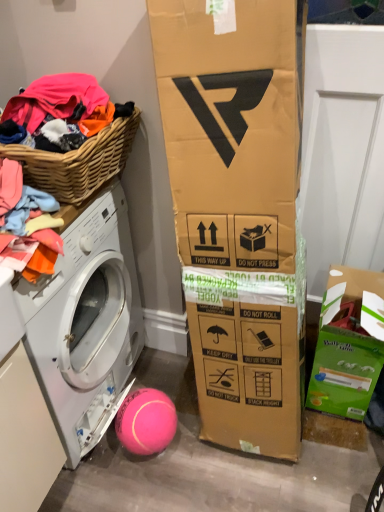
This screenshot has width=384, height=512. Find the location of `green cardboard box at lower right`. green cardboard box at lower right is located at coordinates (345, 347).

Image resolution: width=384 pixels, height=512 pixels. What do you see at coordinates (345, 347) in the screenshot? I see `green cardboard box at lower right` at bounding box center [345, 347].

This screenshot has width=384, height=512. Describe the element at coordinates (78, 162) in the screenshot. I see `woven wood basket at left` at that location.

What is the approximate width of pink rubber ball at lower center?

It is 7.05 inches.

You are a GUI agent. You are given a task and a screenshot of the screen. Output one action in this format:
    pyautogui.click(x=<x>, y=<y>)
    Task: Click on the green cardboard box at lower right
    
    Given the screenshot: What is the action you would take?
    pyautogui.click(x=345, y=347)

Does green cardboard box at lower right have a smaller size compared to pink rubber ball at lower center?

Actually, green cardboard box at lower right might be larger than pink rubber ball at lower center.

Is green cardboard box at lower right touching pink rubber ball at lower center?

No, green cardboard box at lower right is not making contact with pink rubber ball at lower center.

Could you tell me if green cardboard box at lower right is turned towards pink rubber ball at lower center?

No, green cardboard box at lower right is not facing towards pink rubber ball at lower center.

From the image's perspective, which is above, green cardboard box at lower right or pink rubber ball at lower center?

green cardboard box at lower right, from the image's perspective.

From the image's perspective, is white glossy washing machine at left on pink rubber ball at lower center?

Yes, from the image's perspective, white glossy washing machine at left is over pink rubber ball at lower center.

Is white glossy washing machine at left to the right of pink rubber ball at lower center from the viewer's perspective?

In fact, white glossy washing machine at left is to the left of pink rubber ball at lower center.

How much distance is there between white glossy washing machine at left and pink rubber ball at lower center?

12.08 inches.

Is pink rubber ball at lower center at the right side of white glossy washing machine at left?

Yes.

Is white glossy washing machine at left surrounded by pink rubber ball at lower center?

Actually, white glossy washing machine at left is outside pink rubber ball at lower center.

From a real-world perspective, is pink rubber ball at lower center located higher than white glossy washing machine at left?

No, from a real-world perspective, pink rubber ball at lower center is not on top of white glossy washing machine at left.

Does pink rubber ball at lower center have a lesser height compared to green cardboard box at lower right?

Yes.

Find the location of `cardboard box on the right of pink rubber ball at lower center`. cardboard box on the right of pink rubber ball at lower center is located at coordinates click(345, 347).

Relative to white glossy washing machine at left, is green cardboard box at lower right in front or behind?

green cardboard box at lower right is behind white glossy washing machine at left.

Between green cardboard box at lower right and white glossy washing machine at left, which one appears on the right side from the viewer's perspective?

green cardboard box at lower right is more to the right.

Looking at this image, is green cardboard box at lower right situated inside white glossy washing machine at left or outside?

green cardboard box at lower right cannot be found inside white glossy washing machine at left.

Is green cardboard box at lower right next to white glossy washing machine at left and touching it?

No, green cardboard box at lower right is not with white glossy washing machine at left.

From the image's perspective, who appears lower, white glossy washing machine at left or green cardboard box at lower right?

green cardboard box at lower right is shown below in the image.

Does white glossy washing machine at left have a lesser height compared to green cardboard box at lower right?

Incorrect, the height of white glossy washing machine at left does not fall short of that of green cardboard box at lower right.

Can you confirm if white glossy washing machine at left is positioned to the right of green cardboard box at lower right?

No.

Is white glossy washing machine at left smaller than green cardboard box at lower right?

Actually, white glossy washing machine at left might be larger than green cardboard box at lower right.

Is pink rubber ball at lower center far from woven wood basket at left?

No, pink rubber ball at lower center is not far away from woven wood basket at left.

Is pink rubber ball at lower center to the left of woven wood basket at left from the viewer's perspective?

Incorrect, pink rubber ball at lower center is not on the left side of woven wood basket at left.

From the image's perspective, is pink rubber ball at lower center located above or below woven wood basket at left?

pink rubber ball at lower center is below woven wood basket at left.

Between pink rubber ball at lower center and woven wood basket at left, which one has less height?

Standing shorter between the two is woven wood basket at left.

This screenshot has width=384, height=512. In order to click on ball behind the green cardboard box at lower right in this screenshot , I will do `click(146, 421)`.

Where is `washing machine on the left of pink rubber ball at lower center`? The image size is (384, 512). washing machine on the left of pink rubber ball at lower center is located at coordinates (86, 323).

Looking at the image, which one is located further to woven wood basket at left, white glossy washing machine at left or pink rubber ball at lower center?

pink rubber ball at lower center.

Which object lies nearer to the anchor point pink rubber ball at lower center, woven wood basket at left or green cardboard box at lower right?

green cardboard box at lower right is positioned closer to the anchor pink rubber ball at lower center.

Which object lies nearer to the anchor point white glossy washing machine at left, woven wood basket at left or pink rubber ball at lower center?

Among the two, pink rubber ball at lower center is located nearer to white glossy washing machine at left.

Estimate the real-world distances between objects in this image. Which object is further from woven wood basket at left, pink rubber ball at lower center or green cardboard box at lower right?

green cardboard box at lower right.

Based on their spatial positions, is woven wood basket at left or white glossy washing machine at left further from pink rubber ball at lower center?

Based on the image, woven wood basket at left appears to be further to pink rubber ball at lower center.

Looking at the image, which one is located closer to green cardboard box at lower right, woven wood basket at left or pink rubber ball at lower center?

pink rubber ball at lower center.

Based on their spatial positions, is green cardboard box at lower right or white glossy washing machine at left further from woven wood basket at left?

green cardboard box at lower right is further to woven wood basket at left.

Based on their spatial positions, is pink rubber ball at lower center or white glossy washing machine at left closer to woven wood basket at left?

white glossy washing machine at left.

Find the location of a particular element. The height and width of the screenshot is (512, 384). basket situated between white glossy washing machine at left and green cardboard box at lower right from left to right is located at coordinates (78, 162).

Locate an element on the screen. washing machine between woven wood basket at left and pink rubber ball at lower center in the vertical direction is located at coordinates (86, 323).

Where is `ball between woven wood basket at left and green cardboard box at lower right`? Image resolution: width=384 pixels, height=512 pixels. ball between woven wood basket at left and green cardboard box at lower right is located at coordinates (146, 421).

Locate an element on the screen. The height and width of the screenshot is (512, 384). ball located between white glossy washing machine at left and green cardboard box at lower right in the left-right direction is located at coordinates (146, 421).